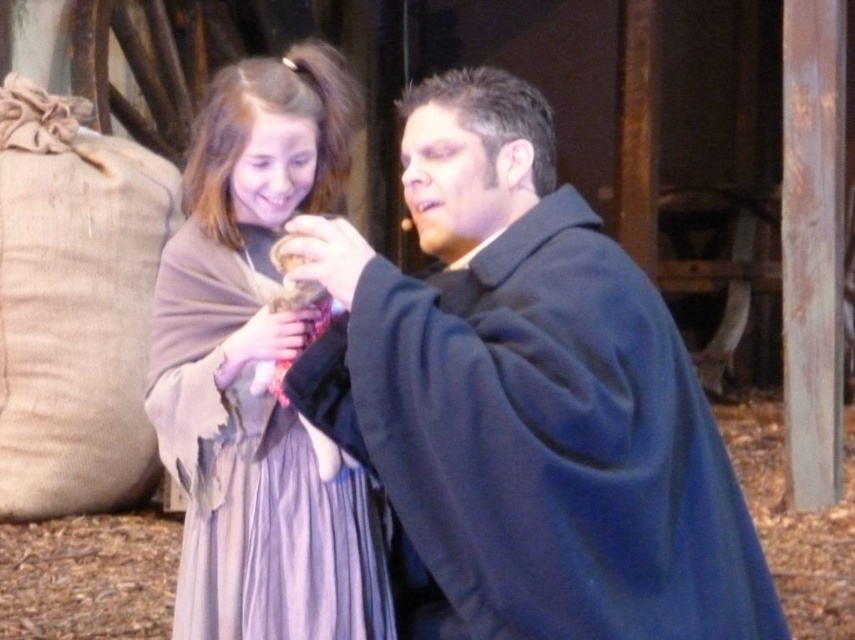
You are a costume designer preparing for a play. You need to ensure that two main characters, wearing the dark blue woolen robe at center and the light brown woolen shawl at center, can pass through a narrow doorway that is 18 inches wide without removing their garments. Can they pass through side by side?

The distance between the dark blue woolen robe at center and the light brown woolen shawl at center is 16.25 inches. Since the doorway is 18 inches wide, they can pass through side by side as the combined width of their garments is less than the doorway width.

You are standing in the rustic setting and want to locate the dark blue woolen robe at center. Where exactly is it positioned in the image?

The dark blue woolen robe at center is located at point coordinates of (526, 397).